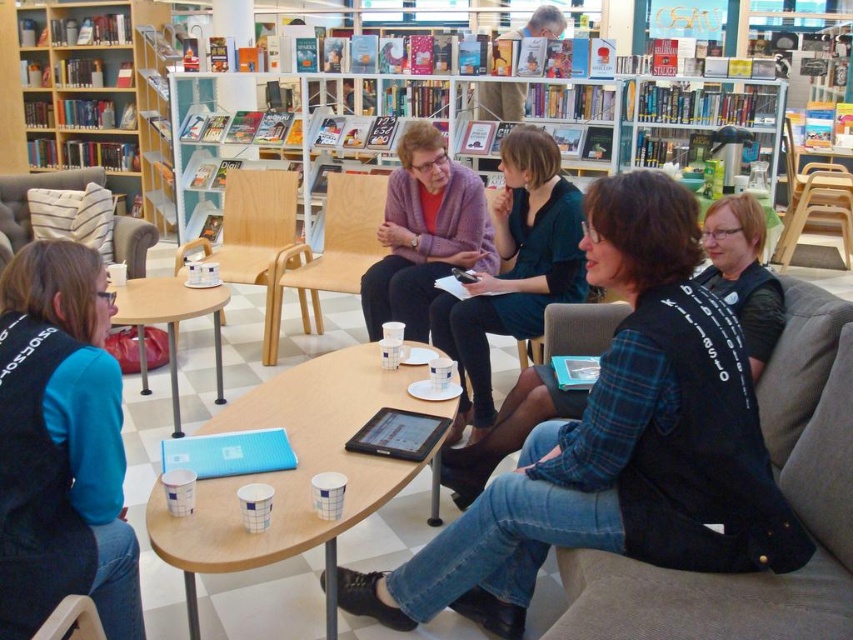
You are a barista who needs to place a new cup on the table without overlapping any existing items. The table has limited space. Which object, the white paper cup at center or the purple knit sweater at center, should you avoid placing the new cup near to ensure enough space?

The white paper cup at center has a larger size compared to the purple knit sweater at center. To ensure enough space, you should avoid placing the new cup near the white paper cup at center since it occupies more space.

You are a customer who wants to reach the wooden bookshelf at upper center to get a book. You are currently standing next to the wooden chair at lower left. Which object do you need to move past first to reach the bookshelf?

You need to move past the wooden chair at lower left first because it is closer to your current position than the wooden bookshelf at upper center, which is further away.